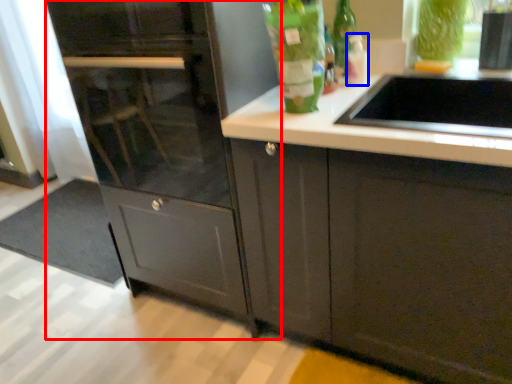
Question: Which object is further to the camera taking this photo, cabinetry (highlighted by a red box) or bottle (highlighted by a blue box)?

Choices:
 (A) cabinetry
 (B) bottle

Answer: (B)